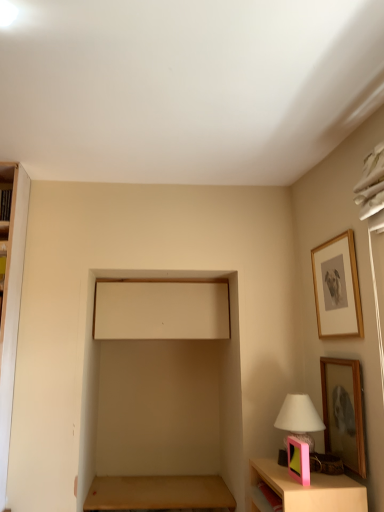
The height and width of the screenshot is (512, 384). Identify the location of wooden picture frame at lower right, positioned as the second picture frame in bottom-to-top order. (343, 412).

The height and width of the screenshot is (512, 384). Identify the location of pink plastic table lamp at lower right. (x=299, y=418).

The height and width of the screenshot is (512, 384). Identify the location of brown wooden table at lower center. (158, 493).

Where is `wooden picture frame at lower right, the 2th picture frame positioned from the top`? The width and height of the screenshot is (384, 512). wooden picture frame at lower right, the 2th picture frame positioned from the top is located at coordinates (343, 412).

Is wooden picture frame at lower right, positioned as the second picture frame in bottom-to-top order, a part of brown wooden table at lower center?

No, brown wooden table at lower center does not contain wooden picture frame at lower right, positioned as the second picture frame in bottom-to-top order.

Looking at this image, from a real-world perspective, between brown wooden table at lower center and wooden picture frame at lower right, the 2th picture frame positioned from the top, who is vertically higher?

In real-world perspective, wooden picture frame at lower right, the 2th picture frame positioned from the top, is above.

How many degrees apart are the facing directions of brown wooden table at lower center and wooden picture frame at lower right, the 2th picture frame positioned from the top?

They differ by 87.1 degrees in their facing directions.

From a real-world perspective, is wooden picture frame at upper right, the 3th picture frame when ordered from left to right, above or below wooden picture frame at lower right, positioned as the second picture frame in bottom-to-top order?

wooden picture frame at upper right, the 3th picture frame when ordered from left to right, is situated higher than wooden picture frame at lower right, positioned as the second picture frame in bottom-to-top order, in the real world.

This screenshot has height=512, width=384. What are the coordinates of `picture frame that is the 1st object directly below the wooden picture frame at upper right, the first picture frame positioned from the right (from a real-world perspective)` in the screenshot? It's located at (343, 412).

Considering the sizes of objects wooden picture frame at upper right, arranged as the first picture frame when viewed from the top, and wooden picture frame at lower right, positioned as the second picture frame in bottom-to-top order, in the image provided, who is shorter, wooden picture frame at upper right, arranged as the first picture frame when viewed from the top, or wooden picture frame at lower right, positioned as the second picture frame in bottom-to-top order,?

With less height is wooden picture frame at upper right, arranged as the first picture frame when viewed from the top.

From the picture: Based on their sizes in the image, would you say wooden picture frame at upper right, the first picture frame positioned from the right, is bigger or smaller than wooden picture frame at lower right, the 2th picture frame positioned from the top?

wooden picture frame at upper right, the first picture frame positioned from the right, is bigger than wooden picture frame at lower right, the 2th picture frame positioned from the top.

From a real-world perspective, is white matte window screen at center positioned above or below pink plastic picture frame at lower right, the third picture frame when ordered from top to bottom?

white matte window screen at center is situated higher than pink plastic picture frame at lower right, the third picture frame when ordered from top to bottom, in the real world.

Between white matte window screen at center and pink plastic picture frame at lower right, which appears as the first picture frame when viewed from the left, which one has smaller size?

Smaller between the two is pink plastic picture frame at lower right, which appears as the first picture frame when viewed from the left.

Is white matte window screen at center spatially inside pink plastic picture frame at lower right, which appears as the first picture frame when viewed from the left, or outside of it?

white matte window screen at center is spatially situated outside pink plastic picture frame at lower right, which appears as the first picture frame when viewed from the left.

Is pink plastic picture frame at lower right, which appears as the first picture frame when viewed from the left, touching brown wooden table at lower center?

No, pink plastic picture frame at lower right, which appears as the first picture frame when viewed from the left, is not in contact with brown wooden table at lower center.

From a real-world perspective, is pink plastic picture frame at lower right, the third picture frame viewed from the right, positioned above or below brown wooden table at lower center?

pink plastic picture frame at lower right, the third picture frame viewed from the right, is above brown wooden table at lower center.

Locate an element on the screen. This screenshot has height=512, width=384. the 3rd picture frame in front when counting from the brown wooden table at lower center is located at coordinates 298,460.

Which is correct: pink plastic picture frame at lower right, the third picture frame viewed from the right, is inside brown wooden table at lower center, or outside of it?

pink plastic picture frame at lower right, the third picture frame viewed from the right, is located beyond the bounds of brown wooden table at lower center.

What's the angular difference between wooden picture frame at lower right, the second picture frame positioned from the right, and white matte window screen at center's facing directions?

wooden picture frame at lower right, the second picture frame positioned from the right, and white matte window screen at center are facing 85.3 degrees away from each other.

Are wooden picture frame at lower right, the second picture frame positioned from the right, and white matte window screen at center making contact?

No, wooden picture frame at lower right, the second picture frame positioned from the right, is not with white matte window screen at center.

Which object is positioned more to the right, wooden picture frame at lower right, the 2th picture frame positioned from the top, or white matte window screen at center?

wooden picture frame at lower right, the 2th picture frame positioned from the top.

Considering the relative sizes of wooden picture frame at lower right, the second picture frame positioned from the right, and white matte window screen at center in the image provided, is wooden picture frame at lower right, the second picture frame positioned from the right, thinner than white matte window screen at center?

Correct, the width of wooden picture frame at lower right, the second picture frame positioned from the right, is less than that of white matte window screen at center.

Consider the image. Is white matte window screen at center with pink plastic table lamp at lower right?

white matte window screen at center is not next to pink plastic table lamp at lower right, and they're not touching.

From the image's perspective, who appears lower, white matte window screen at center or pink plastic table lamp at lower right?

pink plastic table lamp at lower right.

Considering the relative sizes of white matte window screen at center and pink plastic table lamp at lower right in the image provided, is white matte window screen at center wider than pink plastic table lamp at lower right?

Correct, the width of white matte window screen at center exceeds that of pink plastic table lamp at lower right.

Is wooden picture frame at upper right, the first picture frame positioned from the right, facing towards pink plastic table lamp at lower right?

No.

Are wooden picture frame at upper right, the first picture frame positioned from the right, and pink plastic table lamp at lower right far apart?

No, there isn't a large distance between wooden picture frame at upper right, the first picture frame positioned from the right, and pink plastic table lamp at lower right.

From the image's perspective, between wooden picture frame at upper right, the first picture frame positioned from the right, and pink plastic table lamp at lower right, who is located below?

pink plastic table lamp at lower right is shown below in the image.

How different are the orientations of wooden picture frame at upper right, the first picture frame positioned from the right, and pink plastic table lamp at lower right in degrees?

wooden picture frame at upper right, the first picture frame positioned from the right, and pink plastic table lamp at lower right are facing 1.13 degrees away from each other.

Starting from the brown wooden table at lower center, which picture frame is the 2nd one to the right? Please provide its 2D coordinates.

[(343, 412)]

From the wooden picture frame at upper right, the 3th picture frame when ordered from left to right, count 1st picture frames forward and point to it. Please provide its 2D coordinates.

[(343, 412)]

Which object lies nearer to the anchor point pink plastic table lamp at lower right, wooden picture frame at upper right, the 3th picture frame when ordered from left to right, or white matte window screen at center?

wooden picture frame at upper right, the 3th picture frame when ordered from left to right, lies closer to pink plastic table lamp at lower right than the other object.

Considering their positions, is wooden picture frame at lower right, positioned as the second picture frame in bottom-to-top order, positioned closer to pink plastic picture frame at lower right, which is the first picture frame in bottom-to-top order, than pink plastic table lamp at lower right?

pink plastic table lamp at lower right lies closer to pink plastic picture frame at lower right, which is the first picture frame in bottom-to-top order, than the other object.

When comparing their distances from pink plastic table lamp at lower right, does wooden picture frame at upper right, the 3th picture frame when ordered from left to right, or pink plastic picture frame at lower right, which appears as the first picture frame when viewed from the left, seem closer?

pink plastic picture frame at lower right, which appears as the first picture frame when viewed from the left, lies closer to pink plastic table lamp at lower right than the other object.

Considering their positions, is brown wooden table at lower center positioned further to white matte window screen at center than wooden picture frame at lower right, positioned as the second picture frame in bottom-to-top order?

The object further to white matte window screen at center is wooden picture frame at lower right, positioned as the second picture frame in bottom-to-top order.

Considering their positions, is wooden picture frame at upper right, the 3th picture frame when ordered from left to right, positioned further to brown wooden table at lower center than wooden picture frame at lower right, marked as the 2th picture frame in a left-to-right arrangement?

The object further to brown wooden table at lower center is wooden picture frame at upper right, the 3th picture frame when ordered from left to right.

When comparing their distances from pink plastic picture frame at lower right, which appears as the first picture frame when viewed from the left, does white matte window screen at center or wooden picture frame at upper right, which is counted as the third picture frame, starting from the bottom, seem further?

The object further to pink plastic picture frame at lower right, which appears as the first picture frame when viewed from the left, is white matte window screen at center.

Estimate the real-world distances between objects in this image. Which object is closer to wooden picture frame at lower right, the 2th picture frame positioned from the top, white matte window screen at center or wooden picture frame at upper right, the first picture frame positioned from the right?

wooden picture frame at upper right, the first picture frame positioned from the right.

Which object lies further to the anchor point wooden picture frame at lower right, the second picture frame positioned from the right, brown wooden table at lower center or white matte window screen at center?

brown wooden table at lower center is positioned further to the anchor wooden picture frame at lower right, the second picture frame positioned from the right.

You are a GUI agent. You are given a task and a screenshot of the screen. Output one action in this format:
    pyautogui.click(x=<x>, y=<y>)
    Task: Click on the table lamp between pink plastic picture frame at lower right, which is the first picture frame in bottom-to-top order, and wooden picture frame at lower right, the second picture frame positioned from the right
    The image size is (384, 512).
    Given the screenshot: What is the action you would take?
    pyautogui.click(x=299, y=418)

Identify the location of picture frame between wooden picture frame at lower right, the 2th picture frame positioned from the top, and white matte window screen at center from front to back. Image resolution: width=384 pixels, height=512 pixels. (337, 288).

Image resolution: width=384 pixels, height=512 pixels. I want to click on table lamp positioned between wooden picture frame at upper right, the first picture frame positioned from the right, and white matte window screen at center from near to far, so click(x=299, y=418).

Find the location of a particular element. This screenshot has width=384, height=512. table lamp between wooden picture frame at lower right, the 2th picture frame positioned from the top, and white matte window screen at center, along the z-axis is located at coordinates (299, 418).